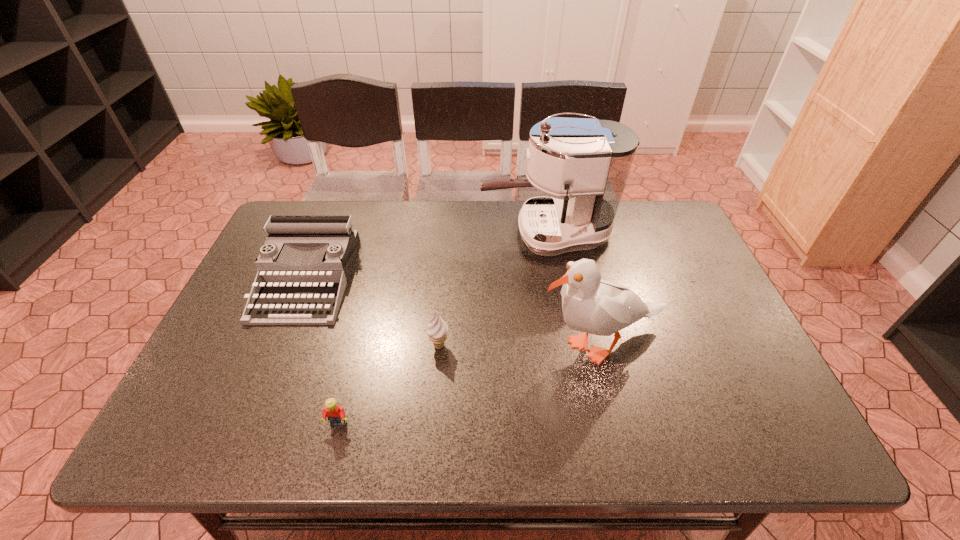
I want to click on free space that satisfies the following two spatial constraints: 1. on the front-facing side of the tallest object; 2. on the face of the nearest object, so click(x=580, y=424).

The height and width of the screenshot is (540, 960). I want to click on free space that satisfies the following two spatial constraints: 1. on the front-facing side of the coffee maker; 2. on the typing side of the leftmost object, so click(555, 278).

Locate an element on the screen. Image resolution: width=960 pixels, height=540 pixels. vacant position in the image that satisfies the following two spatial constraints: 1. on the front-facing side of the coffee maker; 2. on the typing side of the leftmost object is located at coordinates (555, 278).

This screenshot has width=960, height=540. Find the location of `vacant area in the image that satisfies the following two spatial constraints: 1. on the front-facing side of the coffee maker; 2. on the face of the fourth object from right to left`. vacant area in the image that satisfies the following two spatial constraints: 1. on the front-facing side of the coffee maker; 2. on the face of the fourth object from right to left is located at coordinates (580, 424).

Find the location of a particular element. The image size is (960, 540). free location that satisfies the following two spatial constraints: 1. on the front-facing side of the coffee maker; 2. on the face of the nearest object is located at coordinates (580, 424).

At what (x,y) coordinates should I click in order to perform the action: click on vacant region that satisfies the following two spatial constraints: 1. on the front-facing side of the coffee maker; 2. on the face of the nearest object. Please return your answer as a coordinate pair (x, y). The image size is (960, 540). Looking at the image, I should click on (580, 424).

Locate an element on the screen. vacant area in the image that satisfies the following two spatial constraints: 1. at the beak of the gull; 2. on the front-facing side of the third object from right to left is located at coordinates 601,346.

Image resolution: width=960 pixels, height=540 pixels. Find the location of `free space that satisfies the following two spatial constraints: 1. on the front-facing side of the coffee maker; 2. on the front-facing side of the icecream`. free space that satisfies the following two spatial constraints: 1. on the front-facing side of the coffee maker; 2. on the front-facing side of the icecream is located at coordinates (566, 346).